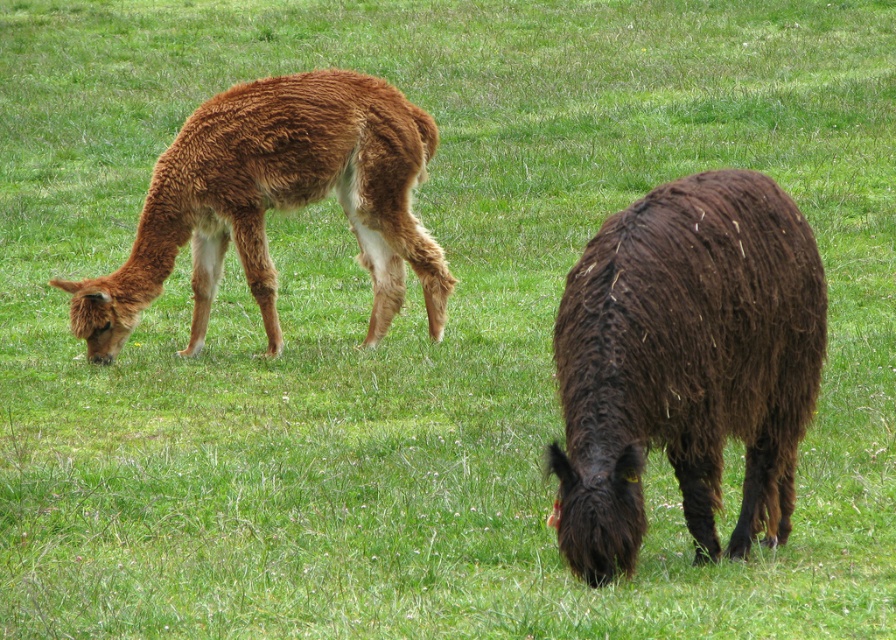
Is dark brown woolly alpaca at right positioned in front of brown woolly alpaca at left?

Yes.

Between point (647, 268) and point (273, 172), which one is positioned in front?

Point (647, 268)

At what (x,y) coordinates should I click in order to perform the action: click on dark brown woolly alpaca at right. Please return your answer as a coordinate pair (x, y). The height and width of the screenshot is (640, 896). Looking at the image, I should click on (686, 364).